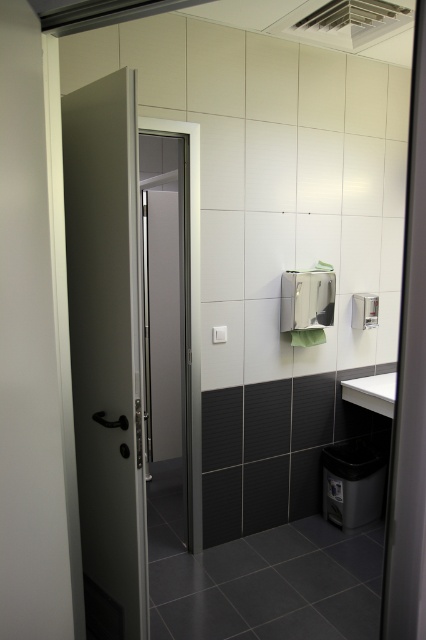
Can you confirm if matte gray door at left is thinner than white glossy sink at right?

Correct, matte gray door at left's width is less than white glossy sink at right's.

Is matte gray door at left below white glossy sink at right?

Actually, matte gray door at left is above white glossy sink at right.

Between point (123, 564) and point (393, 397), which one is positioned in front?

Point (123, 564)

At what (x,y) coordinates should I click in order to perform the action: click on matte gray door at left. Please return your answer as a coordinate pair (x, y). The width and height of the screenshot is (426, 640). Looking at the image, I should click on (106, 349).